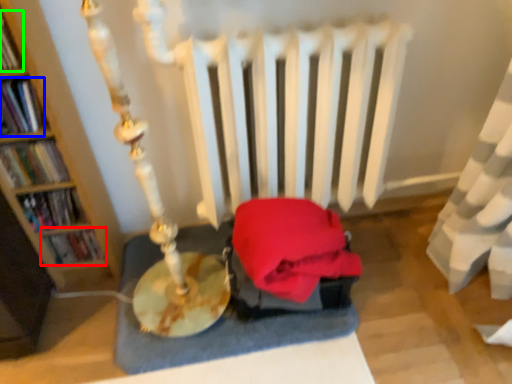
Question: Estimate the real-world distances between objects in this image. Which object is closer to book (highlighted by a red box), book (highlighted by a blue box) or book (highlighted by a green box)?

Choices:
 (A) book
 (B) book

Answer: (A)